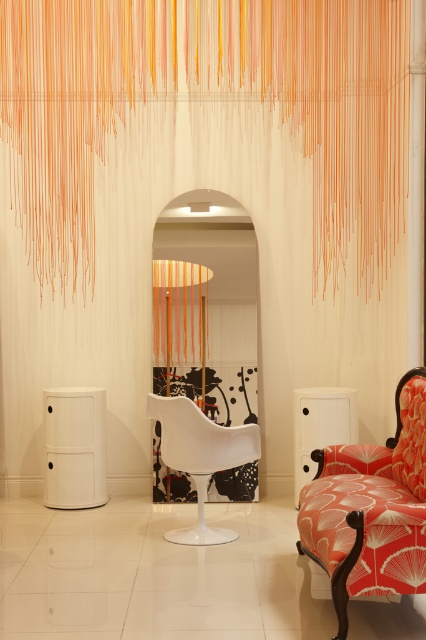
Is orange string curtain at upper center closer to camera compared to orange floral fabric armchair at right?

No, orange string curtain at upper center is behind orange floral fabric armchair at right.

Can you confirm if orange string curtain at upper center is bigger than orange floral fabric armchair at right?

A: Yes.

Which is behind, point (57, 257) or point (363, 449)?

Point (57, 257)

Identify the location of orange string curtain at upper center. (322, 106).

From the picture: Measure the distance between orange floral fabric armchair at right and white matte armchair at center.

A distance of 37.32 inches exists between orange floral fabric armchair at right and white matte armchair at center.

You are a GUI agent. You are given a task and a screenshot of the screen. Output one action in this format:
    pyautogui.click(x=<x>, y=<y>)
    Task: Click on the orange floral fabric armchair at right
    The image size is (426, 640).
    Given the screenshot: What is the action you would take?
    pyautogui.click(x=368, y=506)

This screenshot has height=640, width=426. Find the location of `orange floral fabric armchair at right`. orange floral fabric armchair at right is located at coordinates (368, 506).

Between orange string curtain at upper center and white matte armchair at center, which one has less height?

Standing shorter between the two is white matte armchair at center.

Does orange string curtain at upper center appear on the left side of white matte armchair at center?

Correct, you'll find orange string curtain at upper center to the left of white matte armchair at center.

Which is behind, point (186, 35) or point (187, 465)?

The point (186, 35) is behind.

Locate an element on the screen. The width and height of the screenshot is (426, 640). orange string curtain at upper center is located at coordinates (322, 106).